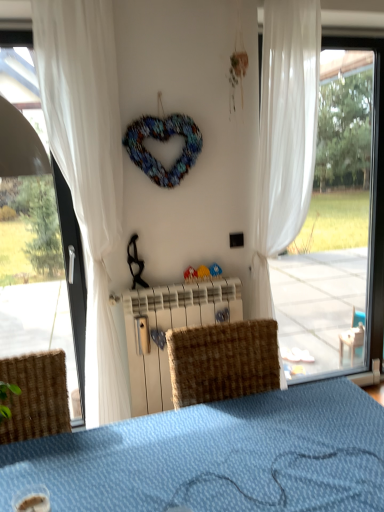
The width and height of the screenshot is (384, 512). I want to click on transparent glass window at right, so click(340, 219).

The width and height of the screenshot is (384, 512). What do you see at coordinates (171, 328) in the screenshot?
I see `white plastic radiator at center` at bounding box center [171, 328].

Locate an element on the screen. white plastic radiator at center is located at coordinates (171, 328).

The image size is (384, 512). Find the location of `white sheer curtain at left, which is the 1th curtain from left to right`. white sheer curtain at left, which is the 1th curtain from left to right is located at coordinates (88, 169).

Which object is wider, white sheer curtain at left, which is the 1th curtain from left to right, or white plastic radiator at center?

white sheer curtain at left, which is the 1th curtain from left to right.

Between white sheer curtain at left, the second curtain when ordered from right to left, and white plastic radiator at center, which one is positioned behind?

Positioned behind is white plastic radiator at center.

Which is farther, (97,411) or (126,318)?

Point (126,318)

Is white sheer curtain at left, the second curtain when ordered from right to left, turned away from white plastic radiator at center?

No, white sheer curtain at left, the second curtain when ordered from right to left, is not facing the opposite direction of white plastic radiator at center.

Locate an element on the screen. Image resolution: width=384 pixels, height=512 pixels. radiator below the white sheer curtain at center, the first curtain in the right-to-left sequence (from a real-world perspective) is located at coordinates (171, 328).

From a real-world perspective, between white plastic radiator at center and white sheer curtain at center, the first curtain in the right-to-left sequence, who is vertically higher?

white sheer curtain at center, the first curtain in the right-to-left sequence, is physically above.

Which object is further away from the camera, white plastic radiator at center or white sheer curtain at center, the first curtain in the right-to-left sequence?

white plastic radiator at center is further from the camera.

From the image's perspective, who appears lower, white plastic radiator at center or white sheer curtain at center, the first curtain in the right-to-left sequence?

white plastic radiator at center.

Does white sheer curtain at center, the first curtain in the right-to-left sequence, appear on the left side of white plastic radiator at center?

In fact, white sheer curtain at center, the first curtain in the right-to-left sequence, is to the right of white plastic radiator at center.

Looking at the image, does white sheer curtain at center, the first curtain in the right-to-left sequence, seem bigger or smaller compared to white plastic radiator at center?

white sheer curtain at center, the first curtain in the right-to-left sequence, is bigger than white plastic radiator at center.

In the image, there is a white sheer curtain at center, which is the second curtain in left-to-right order. What are the coordinates of `radiator below it (from the image's perspective)` in the screenshot? It's located at (171, 328).

I want to click on window behind the white sheer curtain at center, the first curtain in the right-to-left sequence, so click(x=340, y=219).

Is transparent glass window at right positioned with its back to white sheer curtain at center, the first curtain in the right-to-left sequence?

transparent glass window at right is not turned away from white sheer curtain at center, the first curtain in the right-to-left sequence.

From the image's perspective, who appears lower, transparent glass window at right or white sheer curtain at center, the first curtain in the right-to-left sequence?

transparent glass window at right, from the image's perspective.

Is translucent plastic cup at lower left inside or outside of white sheer curtain at center, which is the second curtain in left-to-right order?

translucent plastic cup at lower left exists outside the volume of white sheer curtain at center, which is the second curtain in left-to-right order.

Where is `the 2nd curtain above the translucent plastic cup at lower left (from the image's perspective)`? the 2nd curtain above the translucent plastic cup at lower left (from the image's perspective) is located at coordinates (284, 135).

From a real-world perspective, is translucent plastic cup at lower left below white sheer curtain at center, the first curtain in the right-to-left sequence?

Yes.

Can you see transparent glass window at right touching translucent plastic cup at lower left?

No, transparent glass window at right is not making contact with translucent plastic cup at lower left.

From a real-world perspective, which is physically above, transparent glass window at right or translucent plastic cup at lower left?

transparent glass window at right, from a real-world perspective.

From the image's perspective, which is below, transparent glass window at right or translucent plastic cup at lower left?

translucent plastic cup at lower left appears lower in the image.

Which object is closer to the camera, white sheer curtain at left, the second curtain when ordered from right to left, or white sheer curtain at center, the first curtain in the right-to-left sequence?

Positioned in front is white sheer curtain at left, the second curtain when ordered from right to left.

Is point (100, 72) farther from camera compared to point (291, 64)?

No.

Identify the location of curtain to the right of white sheer curtain at left, the second curtain when ordered from right to left. (284, 135).

What are the coordinates of `the 2nd curtain in front of the white plastic radiator at center` in the screenshot? It's located at (88, 169).

Identify the location of radiator below the white sheer curtain at center, which is the second curtain in left-to-right order (from the image's perspective). This screenshot has width=384, height=512. (171, 328).

Looking at this image, from the image, which object appears to be farther from white sheer curtain at left, which is the 1th curtain from left to right, transparent glass window at right or white sheer curtain at center, the first curtain in the right-to-left sequence?

transparent glass window at right is positioned further to the anchor white sheer curtain at left, which is the 1th curtain from left to right.

When comparing their distances from white sheer curtain at left, the second curtain when ordered from right to left, does white plastic radiator at center or white sheer curtain at center, which is the second curtain in left-to-right order, seem further?

white sheer curtain at center, which is the second curtain in left-to-right order, is further to white sheer curtain at left, the second curtain when ordered from right to left.

From the image, which object appears to be nearer to white sheer curtain at left, the second curtain when ordered from right to left, translucent plastic cup at lower left or white plastic radiator at center?

white plastic radiator at center lies closer to white sheer curtain at left, the second curtain when ordered from right to left, than the other object.

Based on their spatial positions, is translucent plastic cup at lower left or white plastic radiator at center closer to transparent glass window at right?

The object closer to transparent glass window at right is white plastic radiator at center.

When comparing their distances from white sheer curtain at center, the first curtain in the right-to-left sequence, does white sheer curtain at left, which is the 1th curtain from left to right, or transparent glass window at right seem closer?

Among the two, transparent glass window at right is located nearer to white sheer curtain at center, the first curtain in the right-to-left sequence.

When comparing their distances from translucent plastic cup at lower left, does white sheer curtain at left, which is the 1th curtain from left to right, or white plastic radiator at center seem further?

The object further to translucent plastic cup at lower left is white sheer curtain at left, which is the 1th curtain from left to right.

Considering their positions, is transparent glass window at right positioned closer to white plastic radiator at center than translucent plastic cup at lower left?

Among the two, transparent glass window at right is located nearer to white plastic radiator at center.

Estimate the real-world distances between objects in this image. Which object is closer to transparent glass window at right, white sheer curtain at left, which is the 1th curtain from left to right, or white plastic radiator at center?

white plastic radiator at center.

I want to click on beverage between white sheer curtain at left, which is the 1th curtain from left to right, and transparent glass window at right, so click(32, 500).

This screenshot has height=512, width=384. What are the coordinates of `curtain between white plastic radiator at center and transparent glass window at right in the horizontal direction` in the screenshot? It's located at [284, 135].

Identify the location of curtain between translucent plastic cup at lower left and white sheer curtain at center, the first curtain in the right-to-left sequence, in the front-back direction. This screenshot has width=384, height=512. (88, 169).

Image resolution: width=384 pixels, height=512 pixels. Find the location of `radiator between white sheer curtain at left, the second curtain when ordered from right to left, and transparent glass window at right from left to right`. radiator between white sheer curtain at left, the second curtain when ordered from right to left, and transparent glass window at right from left to right is located at coordinates (171, 328).